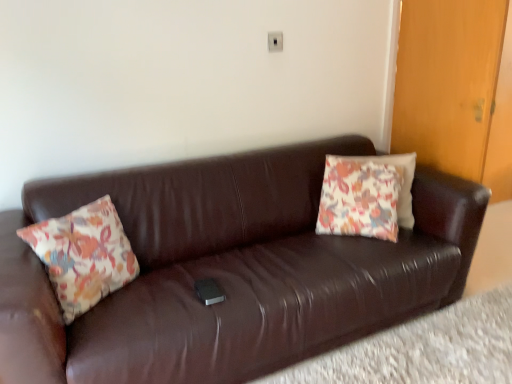
Find the location of a particular element. This screenshot has height=384, width=512. white plastic electric outlet at upper center is located at coordinates click(x=275, y=41).

Measure the distance between floral fabric pillow at center, which ranks as the first pillow in right-to-left order, and camera.

The distance of floral fabric pillow at center, which ranks as the first pillow in right-to-left order, from camera is 6.83 feet.

Identify the location of wooden door at right. click(448, 82).

Find the location of `brown leather couch at center`. brown leather couch at center is located at coordinates (230, 270).

The height and width of the screenshot is (384, 512). Find the location of `white plastic electric outlet at upper center`. white plastic electric outlet at upper center is located at coordinates (275, 41).

Looking at this image, can you confirm if wooden door at right is thinner than brown leather couch at lower center?

Yes.

Would you say wooden door at right is inside or outside brown leather couch at lower center?

wooden door at right is spatially situated outside brown leather couch at lower center.

Is wooden door at right taller or shorter than brown leather couch at lower center?

In the image, wooden door at right appears to be taller than brown leather couch at lower center.

Between wooden door at right and brown leather couch at lower center, which one appears on the right side from the viewer's perspective?

wooden door at right.

The height and width of the screenshot is (384, 512). I want to click on the 2nd pillow to the left when counting from the wooden door at right, so click(83, 255).

Is wooden door at right located within floral fabric pillow at left, the second pillow from the right?

No.

Between point (98, 260) and point (455, 6), which one is positioned in front?

The point (98, 260) is in front.

Between floral fabric pillow at left, which is counted as the 2th pillow, starting from the back, and wooden door at right, which one has more height?

Standing taller between the two is wooden door at right.

From their relative heights in the image, would you say brown leather couch at center is taller or shorter than brown leather couch at lower center?

In the image, brown leather couch at center appears to be taller than brown leather couch at lower center.

Is brown leather couch at center turned away from brown leather couch at lower center?

brown leather couch at center is not turned away from brown leather couch at lower center.

From the picture: Between brown leather couch at center and brown leather couch at lower center, which one has larger size?

With larger size is brown leather couch at center.

Is brown leather couch at center surrounding brown leather couch at lower center?

No, brown leather couch at lower center is not a part of brown leather couch at center.

Does white plastic electric outlet at upper center appear on the left side of brown leather couch at center?

Answer: Incorrect, white plastic electric outlet at upper center is not on the left side of brown leather couch at center.

Between white plastic electric outlet at upper center and brown leather couch at center, which one has less height?

white plastic electric outlet at upper center is shorter.

At what (x,y) coordinates should I click in order to perform the action: click on plain on the left of wooden door at right. Please return your answer as a coordinate pair (x, y). The height and width of the screenshot is (384, 512). Looking at the image, I should click on (423, 349).

Considering the points (474, 337) and (400, 139), which point is behind, point (474, 337) or point (400, 139)?

The point (400, 139) is more distant.

How many degrees apart are the facing directions of brown leather couch at lower center and wooden door at right?

There is a 99.6-degree angle between the facing directions of brown leather couch at lower center and wooden door at right.

From a real-world perspective, is brown leather couch at lower center beneath wooden door at right?

Yes, from a real-world perspective, brown leather couch at lower center is beneath wooden door at right.

Which is closer, (x=390, y=176) or (x=282, y=48)?

The point (x=390, y=176) is closer.

Is floral fabric pillow at center, acting as the second pillow starting from the front, oriented away from white plastic electric outlet at upper center?

No, floral fabric pillow at center, acting as the second pillow starting from the front,'s orientation is not away from white plastic electric outlet at upper center.

Is white plastic electric outlet at upper center a part of floral fabric pillow at center, the second pillow in the left-to-right sequence?

That's incorrect, white plastic electric outlet at upper center is not inside floral fabric pillow at center, the second pillow in the left-to-right sequence.

Who is more distant, floral fabric pillow at center, marked as the first pillow in a back-to-front arrangement, or white plastic electric outlet at upper center?

white plastic electric outlet at upper center.

Is wooden door at right in contact with floral fabric pillow at left, the second pillow from the right?

No, wooden door at right is not in contact with floral fabric pillow at left, the second pillow from the right.

From the image's perspective, is wooden door at right below floral fabric pillow at left, which is counted as the 2th pillow, starting from the back?

No, from the image's perspective, wooden door at right is not below floral fabric pillow at left, which is counted as the 2th pillow, starting from the back.

Which object is positioned more to the right, wooden door at right or floral fabric pillow at left, the second pillow from the right?

From the viewer's perspective, wooden door at right appears more on the right side.

Locate an element on the screen. pillow in front of the wooden door at right is located at coordinates (83, 255).

At what (x,y) coordinates should I click in order to perform the action: click on door above the brown leather couch at lower center (from the image's perspective). Please return your answer as a coordinate pair (x, y). This screenshot has width=512, height=384. Looking at the image, I should click on coord(448,82).

Locate an element on the screen. The height and width of the screenshot is (384, 512). the 2nd pillow to the left of the wooden door at right, starting your count from the anchor is located at coordinates (83, 255).

Considering their positions, is floral fabric pillow at center, the second pillow in the left-to-right sequence, positioned further to brown leather couch at center than brown leather couch at lower center?

brown leather couch at lower center is further to brown leather couch at center.

When comparing their distances from floral fabric pillow at center, marked as the first pillow in a back-to-front arrangement, does floral fabric pillow at left, arranged as the 1th pillow when viewed from the front, or brown leather couch at lower center seem closer?

brown leather couch at lower center lies closer to floral fabric pillow at center, marked as the first pillow in a back-to-front arrangement, than the other object.

Looking at this image, considering their positions, is brown leather couch at lower center positioned further to white plastic electric outlet at upper center than floral fabric pillow at center, the second pillow in the left-to-right sequence?

brown leather couch at lower center is positioned further to the anchor white plastic electric outlet at upper center.

When comparing their distances from white plastic electric outlet at upper center, does floral fabric pillow at left, arranged as the 1th pillow when viewed from the front, or floral fabric pillow at center, the second pillow in the left-to-right sequence, seem further?

Among the two, floral fabric pillow at left, arranged as the 1th pillow when viewed from the front, is located further to white plastic electric outlet at upper center.

Looking at this image, considering their positions, is wooden door at right positioned further to brown leather couch at center than floral fabric pillow at center, marked as the first pillow in a back-to-front arrangement?

wooden door at right lies further to brown leather couch at center than the other object.

When comparing their distances from brown leather couch at lower center, does floral fabric pillow at center, acting as the second pillow starting from the front, or floral fabric pillow at left, which is counted as the 2th pillow, starting from the back, seem closer?

floral fabric pillow at center, acting as the second pillow starting from the front, lies closer to brown leather couch at lower center than the other object.

From the image, which object appears to be nearer to wooden door at right, white plastic electric outlet at upper center or floral fabric pillow at center, the second pillow in the left-to-right sequence?

The object closer to wooden door at right is floral fabric pillow at center, the second pillow in the left-to-right sequence.

Based on their spatial positions, is brown leather couch at lower center or white plastic electric outlet at upper center closer to wooden door at right?

white plastic electric outlet at upper center is positioned closer to the anchor wooden door at right.

Where is `studio couch situated between floral fabric pillow at left, acting as the first pillow starting from the left, and brown leather couch at lower center from left to right`? This screenshot has height=384, width=512. studio couch situated between floral fabric pillow at left, acting as the first pillow starting from the left, and brown leather couch at lower center from left to right is located at coordinates (230, 270).

I want to click on electric outlet situated between floral fabric pillow at left, which is counted as the 2th pillow, starting from the back, and floral fabric pillow at center, the second pillow in the left-to-right sequence, from left to right, so coord(275,41).

The height and width of the screenshot is (384, 512). I want to click on studio couch located between floral fabric pillow at left, which is counted as the 2th pillow, starting from the back, and wooden door at right in the left-right direction, so click(230, 270).

Locate an element on the screen. This screenshot has height=384, width=512. door between brown leather couch at center and white plastic electric outlet at upper center in the front-back direction is located at coordinates (448, 82).